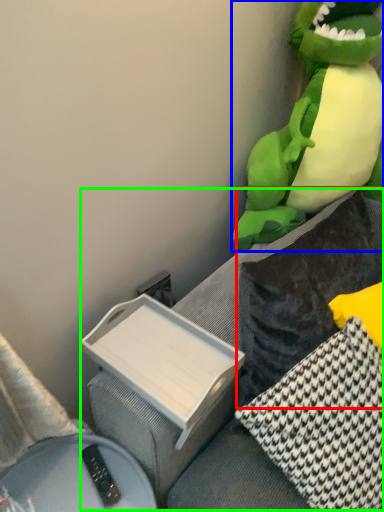
Question: Based on their relative distances, which object is nearer to pillow (highlighted by a red box)? Choose from toy (highlighted by a blue box) and couch (highlighted by a green box).

Choices:
 (A) toy
 (B) couch

Answer: (B)